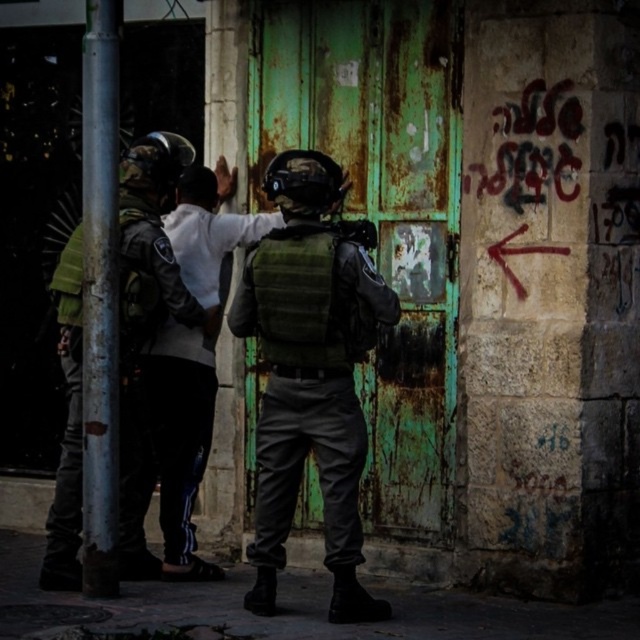
Question: Which is nearer to the silver metallic pole at left?

Choices:
 (A) green matte vest at center
 (B) white cotton shirt at left

Answer: (B)

Question: Is green matte vest at center to the left of white cotton shirt at left from the viewer's perspective?

Choices:
 (A) yes
 (B) no

Answer: (B)

Question: Considering the real-world distances, which object is closest to the silver metallic pole at left?

Choices:
 (A) green matte vest at center
 (B) white cotton shirt at left

Answer: (B)

Question: Does white cotton shirt at left lie in front of silver metallic pole at left?

Choices:
 (A) no
 (B) yes

Answer: (A)

Question: Is the position of green matte vest at center more distant than that of white cotton shirt at left?

Choices:
 (A) yes
 (B) no

Answer: (B)

Question: Which is nearer to the green matte vest at center?

Choices:
 (A) silver metallic pole at left
 (B) white cotton shirt at left

Answer: (B)